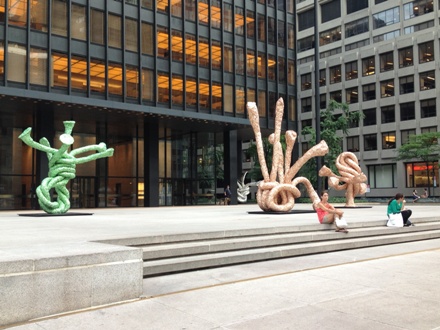
Find the location of a particular element. The image size is (440, 330). red lights is located at coordinates (178, 81), (188, 82), (201, 90), (216, 91), (163, 81).